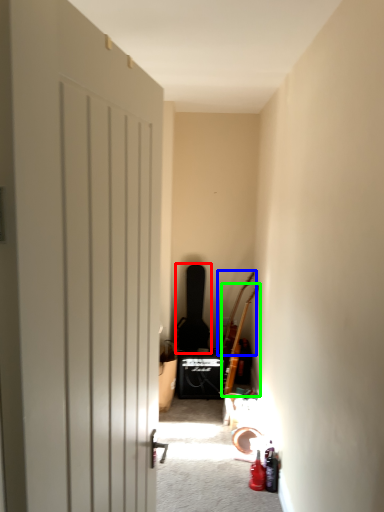
Question: Which object is positioned closest to guitar (highlighted by a red box)? Select from guitar (highlighted by a blue box) and guitar (highlighted by a green box).

Choices:
 (A) guitar
 (B) guitar

Answer: (A)